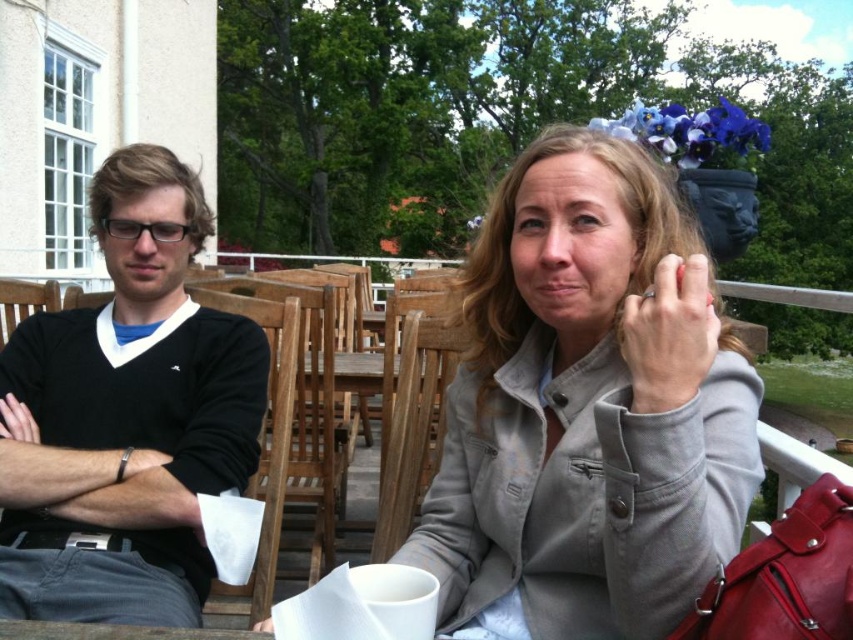
This screenshot has width=853, height=640. Identify the location of gray matte jacket at center. (587, 410).

Who is positioned more to the left, gray matte jacket at center or silver metallic ring at upper right?

Positioned to the left is silver metallic ring at upper right.

Does point (653, 509) come in front of point (699, 256)?

Yes.

Where is `gray matte jacket at center`? The image size is (853, 640). gray matte jacket at center is located at coordinates (587, 410).

Between point (648, 401) and point (4, 400), which one is positioned behind?

Positioned behind is point (4, 400).

Is point (697, 364) farther from viewer compared to point (30, 424)?

No, (697, 364) is in front of (30, 424).

Find the location of a particular element. Image resolution: width=853 pixels, height=640 pixels. silver metallic ring at upper right is located at coordinates coord(669,333).

Where is `black sweater at left`? This screenshot has height=640, width=853. black sweater at left is located at coordinates (128, 417).

Can you confirm if black sweater at left is smaller than matte black hand at left?

Incorrect, black sweater at left is not smaller in size than matte black hand at left.

Where is `black sweater at left`? This screenshot has width=853, height=640. black sweater at left is located at coordinates (128, 417).